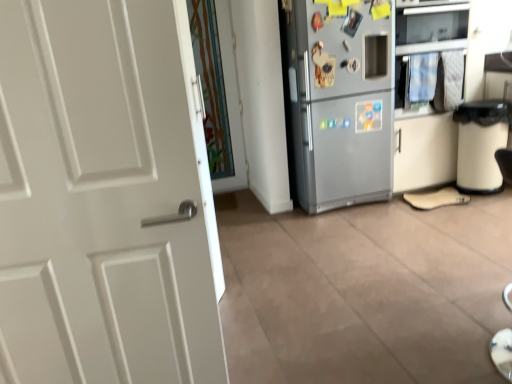
Question: From a real-world perspective, is transparent glass door at center positioned above or below satin silver oven at upper right?

Choices:
 (A) below
 (B) above

Answer: (A)

Question: Based on their sizes in the image, would you say transparent glass door at center is bigger or smaller than satin silver oven at upper right?

Choices:
 (A) small
 (B) big

Answer: (A)

Question: Which is farther from the white plastic trash bin at right?

Choices:
 (A) satin silver refrigerator at center
 (B) beige suede shoe at lower right
 (C) transparent glass door at center
 (D) satin silver oven at upper right

Answer: (C)

Question: Which is nearer to the beige suede shoe at lower right?

Choices:
 (A) white plastic trash bin at right
 (B) satin silver oven at upper right
 (C) satin silver refrigerator at center
 (D) transparent glass door at center

Answer: (A)